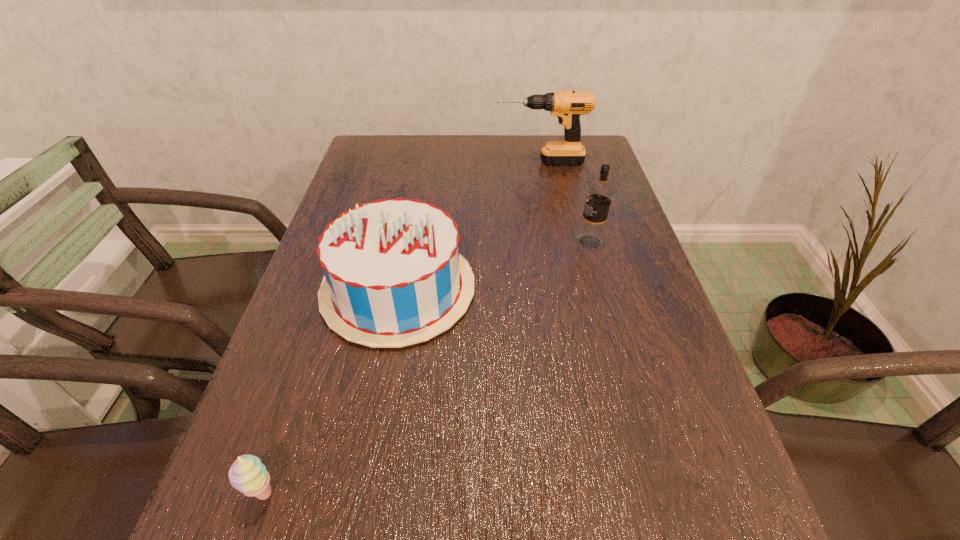
Find the location of a particular element. This screenshot has height=540, width=960. free spot located 0.050m on the label of the vodka is located at coordinates (556, 242).

Locate an element on the screen. This screenshot has height=540, width=960. free space located on the right of the birthday cake is located at coordinates (516, 289).

Locate an element on the screen. This screenshot has height=540, width=960. vacant position located 0.200m on the back of the nearest object is located at coordinates (306, 368).

This screenshot has height=540, width=960. Identify the location of object that is at the far edge. (567, 106).

What are the coordinates of `birthday cake that is at the left edge` in the screenshot? It's located at (394, 277).

Identify the location of sherbert that is at the left edge. (247, 474).

I want to click on drill that is at the right edge, so click(567, 106).

Where is `vodka that is at the right edge`? vodka that is at the right edge is located at coordinates coord(599,195).

This screenshot has width=960, height=540. In order to click on object that is at the far right corner in this screenshot , I will do `click(567, 106)`.

Identify the location of vacant position at the far edge of the desktop. This screenshot has width=960, height=540. (519, 140).